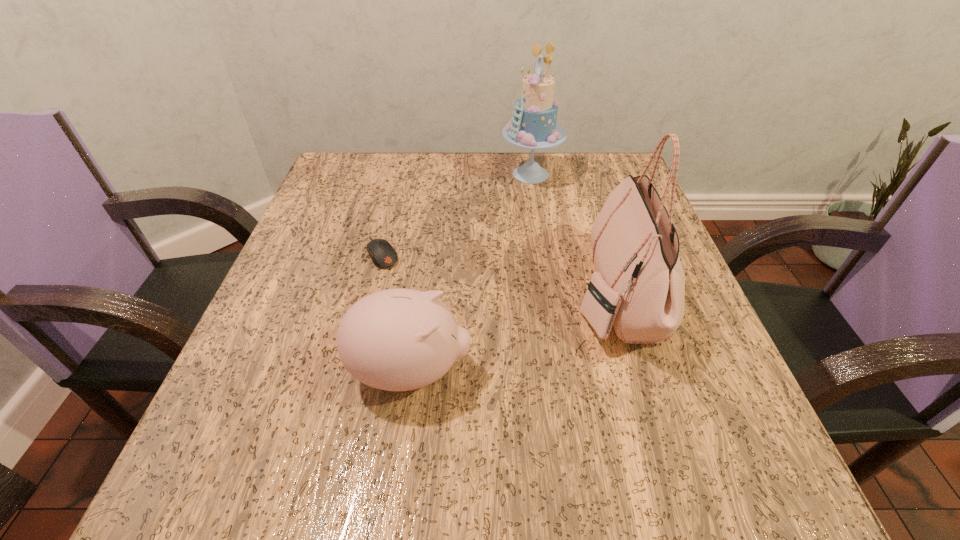
You are a GUI agent. You are given a task and a screenshot of the screen. Output one action in this format:
    pyautogui.click(x=<x>, y=<y>)
    Task: Click on the handbag
    
    Given the screenshot: What is the action you would take?
    pyautogui.click(x=638, y=286)

At what (x,y) coordinates should I click in order to perform the action: click on the farthest object. Please return your answer as a coordinate pair (x, y). This screenshot has height=540, width=960. Looking at the image, I should click on (533, 126).

The width and height of the screenshot is (960, 540). In order to click on the second shortest object in this screenshot , I will do `click(399, 339)`.

Where is `computer mouse`? The image size is (960, 540). computer mouse is located at coordinates (382, 254).

Identify the location of vacant point located 0.120m on the side of the handbag with the attached pouch. The width and height of the screenshot is (960, 540). (508, 294).

At what (x,y) coordinates should I click in order to perform the action: click on vacant area situated 0.150m on the side of the handbag with the attached pouch. Please return your answer as a coordinate pair (x, y). The height and width of the screenshot is (540, 960). Looking at the image, I should click on (491, 294).

Identify the location of vacant space situated 0.300m on the side of the handbag with the attached pouch. Image resolution: width=960 pixels, height=540 pixels. (406, 294).

Find the location of a particular element. vacant area situated with a ladder on the side of the cake is located at coordinates (394, 174).

Find the location of a particular element. This screenshot has width=960, height=540. free space located with a ladder on the side of the cake is located at coordinates (353, 174).

Locate an element on the screen. free space located with a ladder on the side of the cake is located at coordinates tap(435, 174).